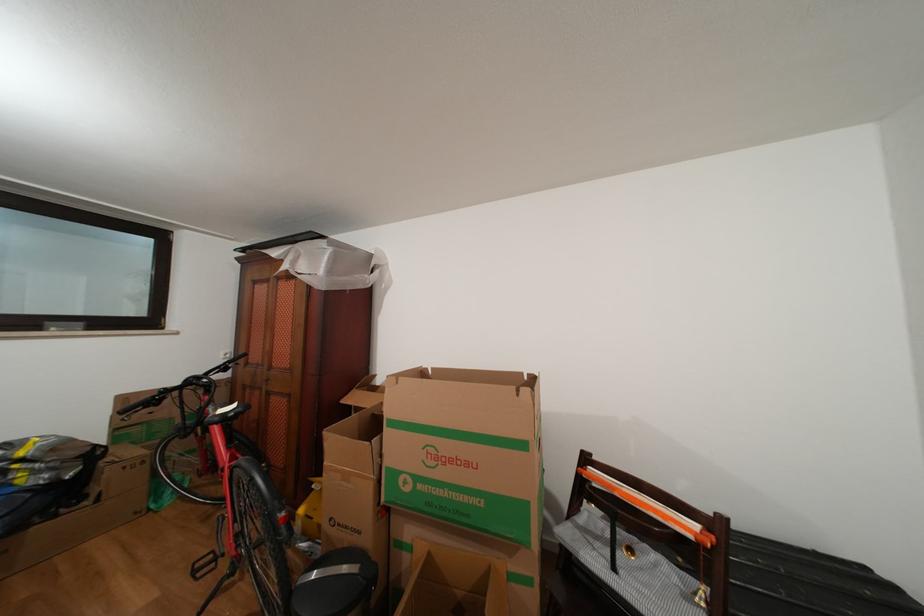
Identify the location of black bicycle seat. The height and width of the screenshot is (616, 924). (225, 414).